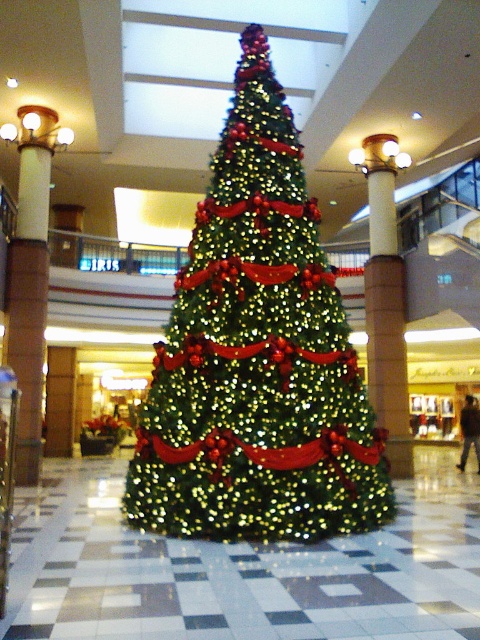
You are a photographer standing in the atrium of the shopping mall. You want to take a photo of the green shiny christmas tree at center without the green matte christmas tree at center appearing in the frame. Is this possible based on their positions?

The green matte christmas tree at center is located above the green shiny christmas tree at center, so it is blocking the view. Therefore, it is not possible to take a photo of the green shiny christmas tree at center without the green matte christmas tree at center appearing in the frame.

You are standing in the shopping mall atrium and want to take a photo of the green matte christmas tree at center. If your camera has a maximum focus range of 20 feet, will you be able to capture the tree clearly?

The distance between you and the green matte christmas tree at center is 21.18 feet, which exceeds the camera maximum focus range of 20 feet. Therefore, you will not be able to capture the tree clearly.